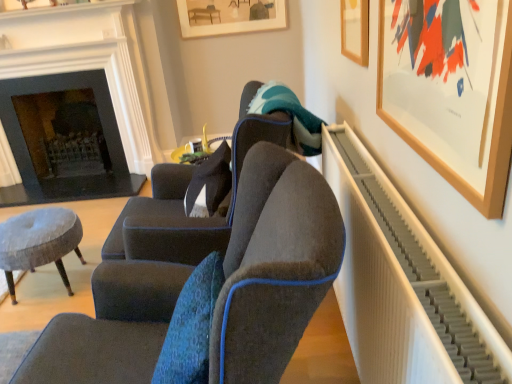
This screenshot has height=384, width=512. What do you see at coordinates (402, 284) in the screenshot?
I see `white ribbed radiator at right` at bounding box center [402, 284].

This screenshot has height=384, width=512. Describe the element at coordinates (230, 16) in the screenshot. I see `wooden framed artwork at upper center, acting as the 3th picture frame starting from the bottom` at that location.

What do you see at coordinates (71, 106) in the screenshot? I see `dark gray stone fireplace at left` at bounding box center [71, 106].

Identify the location of velvet dark gray armchair at center, the first chair when ordered from back to front. The width and height of the screenshot is (512, 384). (194, 196).

What is the approximate width of wooden picture frame at upper right, placed as the 2th picture frame when sorted from bottom to top?

It is 1.89 inches.

This screenshot has width=512, height=384. What do you see at coordinates (355, 30) in the screenshot? I see `wooden picture frame at upper right, the 2th picture frame when ordered from back to front` at bounding box center [355, 30].

At what (x,y) coordinates should I click in order to perform the action: click on wooden picture frame at upper right, the 3th picture frame viewed from the back. Please return your answer as a coordinate pair (x, y). The width and height of the screenshot is (512, 384). Looking at the image, I should click on (451, 90).

How much space does wooden picture frame at upper right, which ranks as the first picture frame in bottom-to-top order, occupy vertically?

wooden picture frame at upper right, which ranks as the first picture frame in bottom-to-top order, is 13.76 inches tall.

Locate an element on the screen. The image size is (512, 384). velvet grey stool at lower left is located at coordinates pos(39,242).

Is wooden picture frame at upper right, the 3th picture frame viewed from the back, inside or outside of velvet dark gray armchair at center, which is the 2th chair in front-to-back order?

wooden picture frame at upper right, the 3th picture frame viewed from the back, is not enclosed by velvet dark gray armchair at center, which is the 2th chair in front-to-back order.

From a real-world perspective, is wooden picture frame at upper right, the 1th picture frame in the right-to-left sequence, on velvet dark gray armchair at center, which is the 2th chair in front-to-back order?

Yes.

In the scene shown: Could you tell me if wooden picture frame at upper right, the 1th picture frame in the right-to-left sequence, is facing velvet dark gray armchair at center, which is the 2th chair in front-to-back order?

No.

From a real-world perspective, is dark gray stone fireplace at left below velvet dark gray chair at center, marked as the 2th chair in a back-to-front arrangement?

No, from a real-world perspective, dark gray stone fireplace at left is not under velvet dark gray chair at center, marked as the 2th chair in a back-to-front arrangement.

Is dark gray stone fireplace at left looking in the opposite direction of velvet dark gray chair at center, marked as the 2th chair in a back-to-front arrangement?

No, velvet dark gray chair at center, marked as the 2th chair in a back-to-front arrangement, is not at the back of dark gray stone fireplace at left.

Locate an element on the screen. the 2nd chair positioned below the dark gray stone fireplace at left (from the image's perspective) is located at coordinates (274, 266).

From the image's perspective, is dark gray stone fireplace at left above or below velvet dark gray chair at center, positioned as the 1th chair in front-to-back order?

dark gray stone fireplace at left is situated higher than velvet dark gray chair at center, positioned as the 1th chair in front-to-back order, in the image.

Do you think wooden framed artwork at upper center, which is the third picture frame from front to back, is within white ribbed radiator at right, or outside of it?

wooden framed artwork at upper center, which is the third picture frame from front to back, is spatially situated outside white ribbed radiator at right.

Is there a large distance between wooden framed artwork at upper center, which is the first picture frame from left to right, and white ribbed radiator at right?

wooden framed artwork at upper center, which is the first picture frame from left to right, is far away from white ribbed radiator at right.

Considering the sizes of objects wooden framed artwork at upper center, which is the third picture frame from front to back, and white ribbed radiator at right in the image provided, who is wider, wooden framed artwork at upper center, which is the third picture frame from front to back, or white ribbed radiator at right?

With larger width is white ribbed radiator at right.

How different are the orientations of wooden framed artwork at upper center, positioned as the first picture frame in top-to-bottom order, and white ribbed radiator at right in degrees?

The facing directions of wooden framed artwork at upper center, positioned as the first picture frame in top-to-bottom order, and white ribbed radiator at right are 91.3 degrees apart.

Can you confirm if dark gray stone fireplace at left is taller than wooden framed artwork at upper center, acting as the first picture frame starting from the back?

Yes.

From a real-world perspective, who is located higher, dark gray stone fireplace at left or wooden framed artwork at upper center, which is the first picture frame from left to right?

From a 3D spatial view, wooden framed artwork at upper center, which is the first picture frame from left to right, is above.

Between dark gray stone fireplace at left and wooden framed artwork at upper center, acting as the 3th picture frame starting from the bottom, which one appears on the left side from the viewer's perspective?

dark gray stone fireplace at left.

Does dark gray stone fireplace at left have a greater width compared to wooden framed artwork at upper center, positioned as the first picture frame in top-to-bottom order?

Correct, the width of dark gray stone fireplace at left exceeds that of wooden framed artwork at upper center, positioned as the first picture frame in top-to-bottom order.

Where is `stool below the wooden picture frame at upper right, the third picture frame positioned from the top (from a real-world perspective)`? This screenshot has width=512, height=384. stool below the wooden picture frame at upper right, the third picture frame positioned from the top (from a real-world perspective) is located at coordinates (39, 242).

From a real-world perspective, is velvet grey stool at lower left above or below wooden picture frame at upper right, the third picture frame positioned from the top?

Clearly, from a real-world perspective, velvet grey stool at lower left is below wooden picture frame at upper right, the third picture frame positioned from the top.

Which of these two, velvet grey stool at lower left or wooden picture frame at upper right, which ranks as the 3th picture frame in left-to-right order, stands taller?

velvet grey stool at lower left.

Is velvet grey stool at lower left next to wooden picture frame at upper right, the third picture frame positioned from the top, and touching it?

velvet grey stool at lower left and wooden picture frame at upper right, the third picture frame positioned from the top, are clearly separated.

Is wooden picture frame at upper right, which ranks as the first picture frame in bottom-to-top order, located outside wooden framed artwork at upper center, which is the first picture frame from left to right?

Yes, wooden picture frame at upper right, which ranks as the first picture frame in bottom-to-top order, is not within wooden framed artwork at upper center, which is the first picture frame from left to right.

Can you confirm if wooden picture frame at upper right, the third picture frame positioned from the top, is shorter than wooden framed artwork at upper center, which is the third picture frame from front to back?

No, wooden picture frame at upper right, the third picture frame positioned from the top, is not shorter than wooden framed artwork at upper center, which is the third picture frame from front to back.

From a real-world perspective, between wooden picture frame at upper right, which appears as the 1th picture frame when viewed from the front, and wooden framed artwork at upper center, positioned as the first picture frame in top-to-bottom order, who is vertically lower?

wooden picture frame at upper right, which appears as the 1th picture frame when viewed from the front, from a real-world perspective.

Is wooden picture frame at upper right, the third picture frame positioned from the top, aimed at wooden framed artwork at upper center, acting as the first picture frame starting from the back?

No, wooden picture frame at upper right, the third picture frame positioned from the top, is not oriented towards wooden framed artwork at upper center, acting as the first picture frame starting from the back.

Relative to velvet dark gray armchair at center, which is the 2th chair in front-to-back order, is velvet dark gray chair at center, marked as the 2th chair in a back-to-front arrangement, in front or behind?

velvet dark gray chair at center, marked as the 2th chair in a back-to-front arrangement, is positioned closer to the viewer than velvet dark gray armchair at center, which is the 2th chair in front-to-back order.

Can you confirm if velvet dark gray chair at center, positioned as the 1th chair in front-to-back order, is shorter than velvet dark gray armchair at center, which is the 2th chair in front-to-back order?

Indeed, velvet dark gray chair at center, positioned as the 1th chair in front-to-back order, has a lesser height compared to velvet dark gray armchair at center, which is the 2th chair in front-to-back order.

Is velvet dark gray chair at center, marked as the 2th chair in a back-to-front arrangement, facing towards velvet dark gray armchair at center, the first chair when ordered from back to front?

No, velvet dark gray chair at center, marked as the 2th chair in a back-to-front arrangement, is not oriented towards velvet dark gray armchair at center, the first chair when ordered from back to front.

Locate an element on the screen. The width and height of the screenshot is (512, 384). picture frame that is the 2nd object located in front of the velvet dark gray armchair at center, the first chair when ordered from back to front is located at coordinates (451, 90).

In order to click on fireplace above the velvet dark gray chair at center, positioned as the 1th chair in front-to-back order (from a real-world perspective) in this screenshot , I will do `click(71, 106)`.

From the image, which object appears to be farther from velvet grey stool at lower left, wooden picture frame at upper right, placed as the 2th picture frame when sorted from bottom to top, or wooden picture frame at upper right, which ranks as the first picture frame in bottom-to-top order?

wooden picture frame at upper right, which ranks as the first picture frame in bottom-to-top order, is further to velvet grey stool at lower left.

Estimate the real-world distances between objects in this image. Which object is closer to wooden picture frame at upper right, placed as the 2th picture frame when sorted from top to bottom, velvet grey stool at lower left or wooden framed artwork at upper center, acting as the 3th picture frame starting from the bottom?

Based on the image, velvet grey stool at lower left appears to be nearer to wooden picture frame at upper right, placed as the 2th picture frame when sorted from top to bottom.

Based on their spatial positions, is wooden framed artwork at upper center, positioned as the first picture frame in top-to-bottom order, or dark gray stone fireplace at left closer to velvet grey stool at lower left?

dark gray stone fireplace at left is closer to velvet grey stool at lower left.

Estimate the real-world distances between objects in this image. Which object is further from wooden picture frame at upper right, placed as the 2th picture frame when sorted from bottom to top, velvet grey stool at lower left or white ribbed radiator at right?

velvet grey stool at lower left.

Considering their positions, is wooden picture frame at upper right, which is the second picture frame from left to right, positioned further to velvet dark gray armchair at center, which is the 2th chair in front-to-back order, than dark gray stone fireplace at left?

dark gray stone fireplace at left is further to velvet dark gray armchair at center, which is the 2th chair in front-to-back order.

When comparing their distances from wooden picture frame at upper right, which ranks as the 3th picture frame in left-to-right order, does velvet dark gray armchair at center, the first chair when ordered from back to front, or dark gray stone fireplace at left seem closer?

Among the two, velvet dark gray armchair at center, the first chair when ordered from back to front, is located nearer to wooden picture frame at upper right, which ranks as the 3th picture frame in left-to-right order.

Looking at the image, which one is located further to wooden picture frame at upper right, the 1th picture frame in the right-to-left sequence, wooden framed artwork at upper center, acting as the 3th picture frame starting from the bottom, or velvet dark gray chair at center, marked as the 2th chair in a back-to-front arrangement?

wooden framed artwork at upper center, acting as the 3th picture frame starting from the bottom.

Estimate the real-world distances between objects in this image. Which object is closer to wooden framed artwork at upper center, acting as the 3th picture frame starting from the bottom, wooden picture frame at upper right, the 3th picture frame viewed from the back, or velvet grey stool at lower left?

velvet grey stool at lower left.

Locate an element on the screen. The width and height of the screenshot is (512, 384). picture frame positioned between wooden picture frame at upper right, which appears as the 1th picture frame when viewed from the front, and velvet dark gray armchair at center, the first chair when ordered from back to front, from near to far is located at coordinates (355, 30).

Locate an element on the screen. The image size is (512, 384). stool between velvet dark gray armchair at center, which is the 2th chair in front-to-back order, and dark gray stone fireplace at left, along the z-axis is located at coordinates (39, 242).

Image resolution: width=512 pixels, height=384 pixels. What are the coordinates of `stool between dark gray stone fireplace at left and wooden picture frame at upper right, the 2th picture frame when ordered from back to front, in the horizontal direction` in the screenshot? It's located at (39, 242).

Locate an element on the screen. Image resolution: width=512 pixels, height=384 pixels. stool between white ribbed radiator at right and wooden framed artwork at upper center, which is the third picture frame from front to back, in the front-back direction is located at coordinates (39, 242).